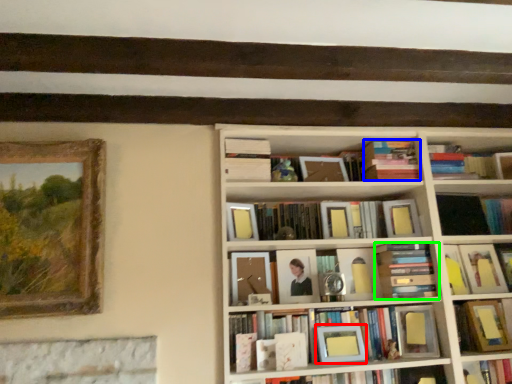
Question: Which object is the closest to the picture frame (highlighted by a red box)? Choose among these: book (highlighted by a blue box) or book (highlighted by a green box).

Choices:
 (A) book
 (B) book

Answer: (B)